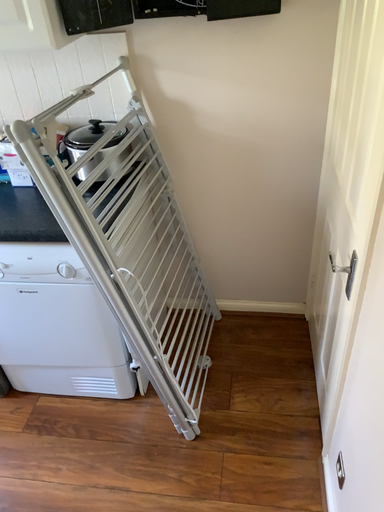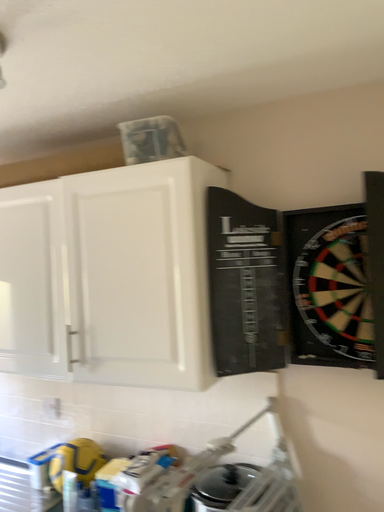
Question: Which way did the camera rotate in the video?

Choices:
 (A) rotated right
 (B) rotated left

Answer: (B)